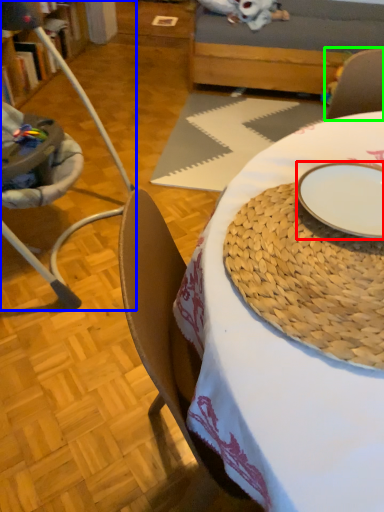
Question: Which is nearer to the plate (highlighted by a red box)? chair (highlighted by a blue box) or armchair (highlighted by a green box).

Choices:
 (A) chair
 (B) armchair

Answer: (B)